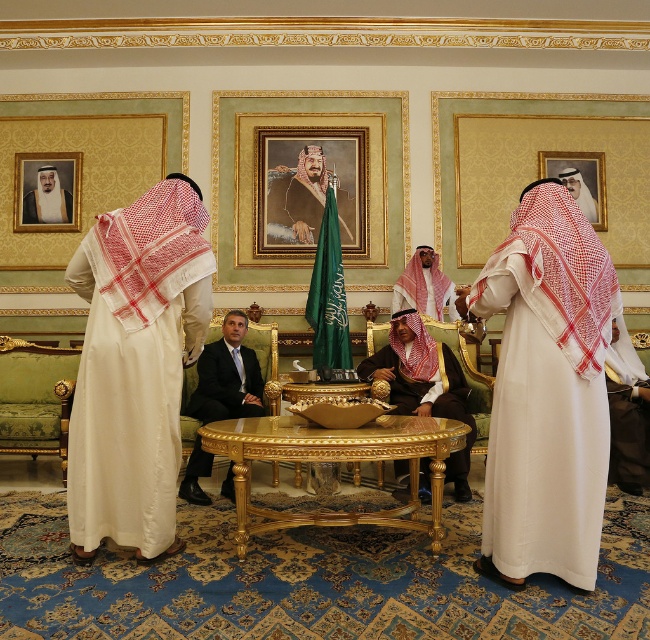
Question: Which of these objects is positioned farthest from the matte white robe at center?

Choices:
 (A) dark blue suit at center
 (B) brown suede robe at center
 (C) matte gold picture frame at upper right
 (D) white woven robe at center

Answer: (D)

Question: Is white silk robe at left positioned in front of white cotton robe at upper left?

Choices:
 (A) yes
 (B) no

Answer: (A)

Question: Considering the relative positions of white silk robe at left and white textured robe at center in the image provided, where is white silk robe at left located with respect to white textured robe at center?

Choices:
 (A) left
 (B) right

Answer: (A)

Question: Which object is the closest to the matte white robe at center?

Choices:
 (A) white woven robe at center
 (B) white textured robe at center
 (C) brown suede robe at center

Answer: (B)

Question: From the image, what is the correct spatial relationship of gold-framed portrait at center in relation to matte gold picture frame at upper right?

Choices:
 (A) left
 (B) right

Answer: (A)

Question: Among these points, which one is farthest from the camera?

Choices:
 (A) (27, 209)
 (B) (18, 198)

Answer: (A)